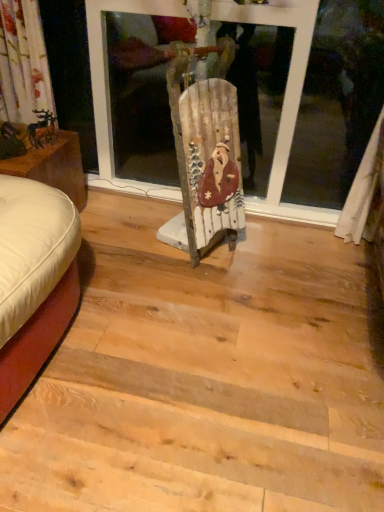
Question: Does white leather ottoman at left have a greater height compared to metallic gold reindeer at left?

Choices:
 (A) yes
 (B) no

Answer: (A)

Question: Is metallic gold reindeer at left surrounded by white leather ottoman at left?

Choices:
 (A) no
 (B) yes

Answer: (A)

Question: Is white leather ottoman at left shorter than metallic gold reindeer at left?

Choices:
 (A) no
 (B) yes

Answer: (A)

Question: Is the position of white leather ottoman at left less distant than that of metallic gold reindeer at left?

Choices:
 (A) yes
 (B) no

Answer: (A)

Question: From the image's perspective, does white leather ottoman at left appear lower than metallic gold reindeer at left?

Choices:
 (A) yes
 (B) no

Answer: (A)

Question: Considering the relative sizes of white leather ottoman at left and metallic gold reindeer at left in the image provided, is white leather ottoman at left smaller than metallic gold reindeer at left?

Choices:
 (A) yes
 (B) no

Answer: (B)

Question: Is metallic gold reindeer at left far away from white leather ottoman at left?

Choices:
 (A) no
 (B) yes

Answer: (A)

Question: Is metallic gold reindeer at left at the left side of white leather ottoman at left?

Choices:
 (A) no
 (B) yes

Answer: (A)

Question: Does metallic gold reindeer at left have a lesser width compared to white leather ottoman at left?

Choices:
 (A) no
 (B) yes

Answer: (B)

Question: Is metallic gold reindeer at left with white leather ottoman at left?

Choices:
 (A) yes
 (B) no

Answer: (B)

Question: Can you confirm if metallic gold reindeer at left is bigger than white leather ottoman at left?

Choices:
 (A) yes
 (B) no

Answer: (B)

Question: Does metallic gold reindeer at left contain white leather ottoman at left?

Choices:
 (A) no
 (B) yes

Answer: (A)

Question: Based on their positions, is white leather ottoman at left located to the left or right of metallic gold reindeer at left?

Choices:
 (A) right
 (B) left

Answer: (B)